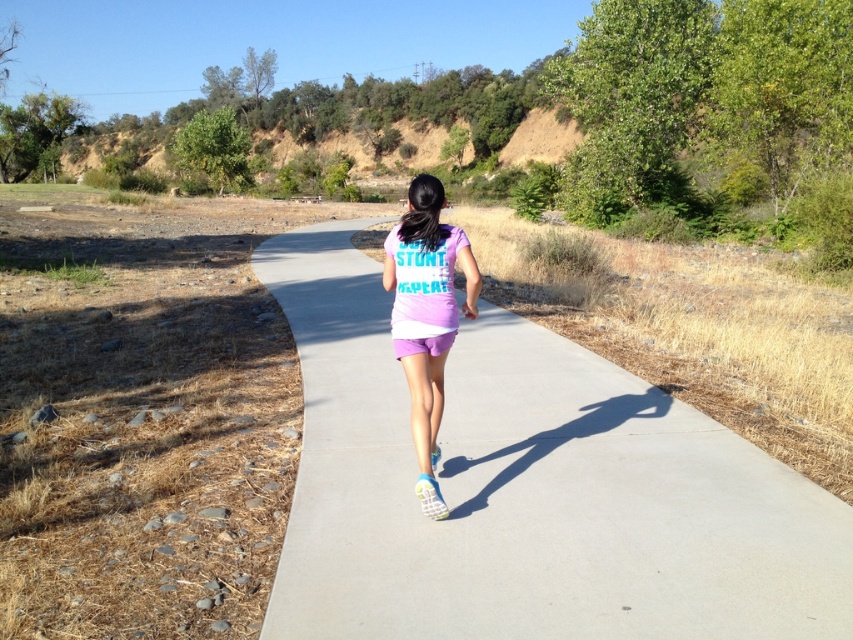
Question: Can you confirm if smooth concrete pavement at center is wider than purple matte shorts at center?

Choices:
 (A) no
 (B) yes

Answer: (B)

Question: Among these objects, which one is farthest from the camera?

Choices:
 (A) purple matte shorts at center
 (B) smooth concrete pavement at center

Answer: (A)

Question: Among these objects, which one is farthest from the camera?

Choices:
 (A) smooth concrete pavement at center
 (B) purple matte shorts at center

Answer: (B)

Question: Can you confirm if smooth concrete pavement at center is wider than purple matte shorts at center?

Choices:
 (A) yes
 (B) no

Answer: (A)

Question: Is smooth concrete pavement at center smaller than purple matte shorts at center?

Choices:
 (A) yes
 (B) no

Answer: (B)